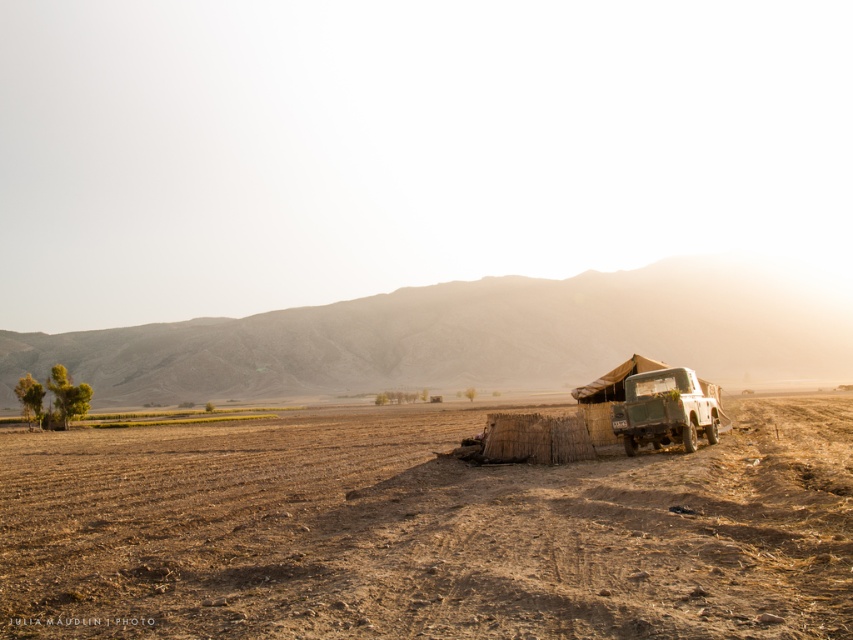
You are standing at the point labeled as point (425, 531) in the image. What is the immediate surface you are standing on?

The immediate surface you are standing on is the brown dirt field at center, as indicated by the point (425, 531).

You are standing at the origin point of the image coordinate system. Where is the brown dirt field at center located?

The brown dirt field at center is located at point (425, 531).